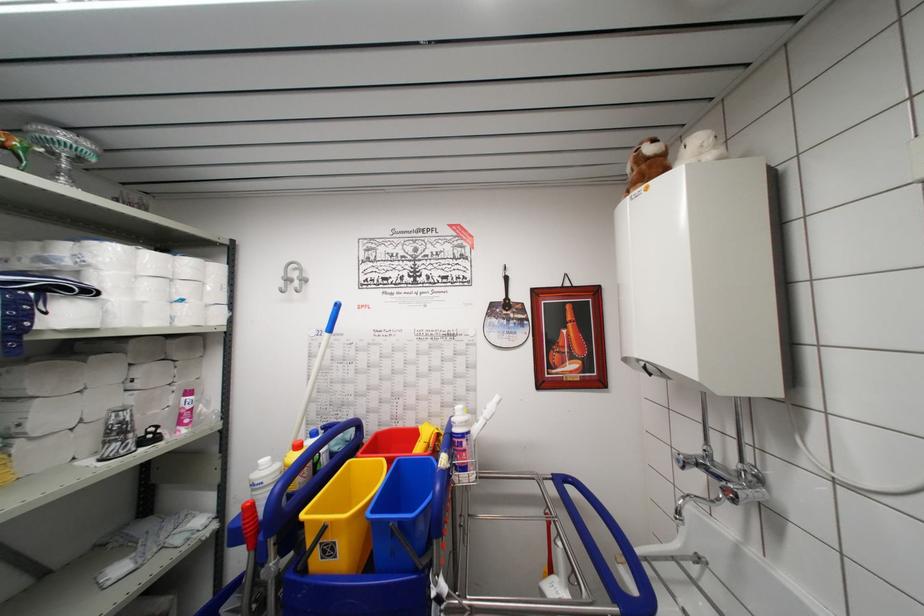
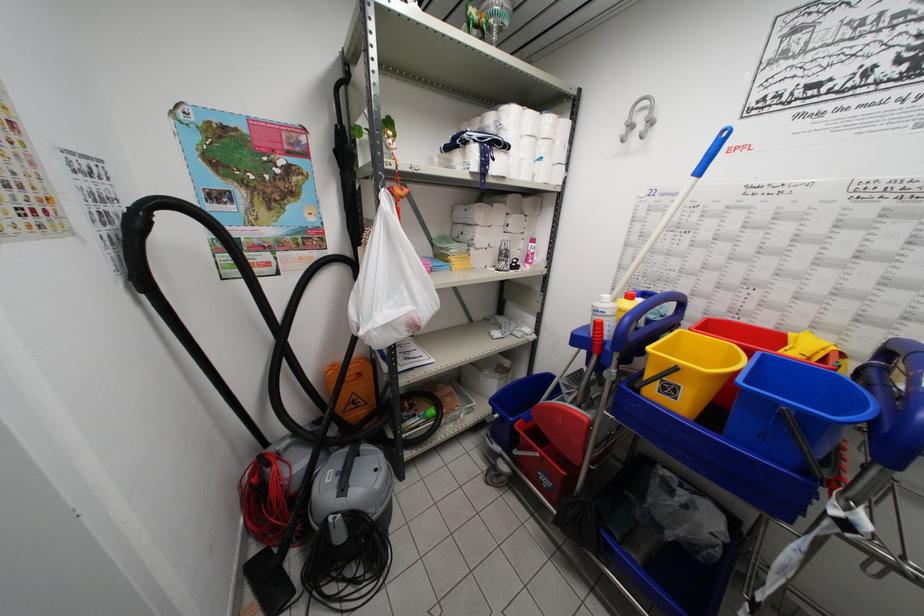
How did the camera likely rotate?

The camera's rotation is toward left-down.